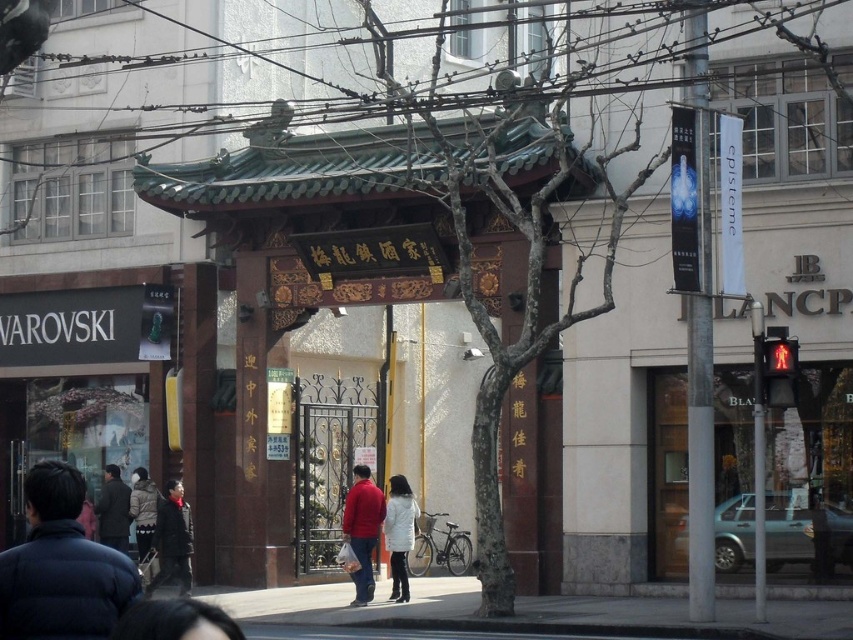
Question: Which of these objects is positioned farthest from the red matte jacket at center?

Choices:
 (A) dark brown jacket at lower left
 (B) dark brown coat at center
 (C) dark blue jacket at lower left

Answer: (C)

Question: In this image, where is gray concrete pavement at lower center located relative to dark gray coat at center?

Choices:
 (A) below
 (B) above

Answer: (A)

Question: Which of the following is the farthest from the observer?

Choices:
 (A) dark gray coat at center
 (B) dark brown coat at center

Answer: (B)

Question: Does gray concrete pavement at lower center have a greater width compared to dark blue jacket at lower left?

Choices:
 (A) no
 (B) yes

Answer: (B)

Question: Which point is farther to the camera?

Choices:
 (A) red matte jacket at center
 (B) white wool coat at center
 (C) dark brown coat at center

Answer: (C)

Question: Is gray concrete pavement at lower center smaller than dark brown jacket at lower left?

Choices:
 (A) yes
 (B) no

Answer: (B)